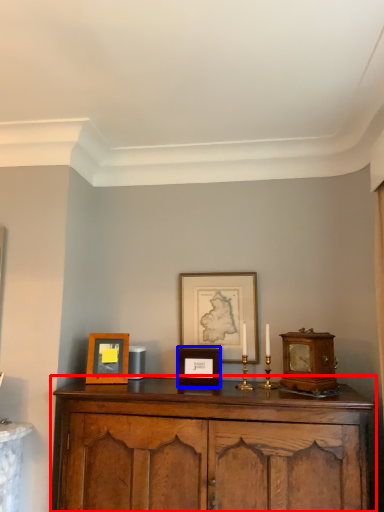
Question: Which of the following is the closest to the observer, cabinetry (highlighted by a red box) or picture frame (highlighted by a blue box)?

Choices:
 (A) cabinetry
 (B) picture frame

Answer: (A)